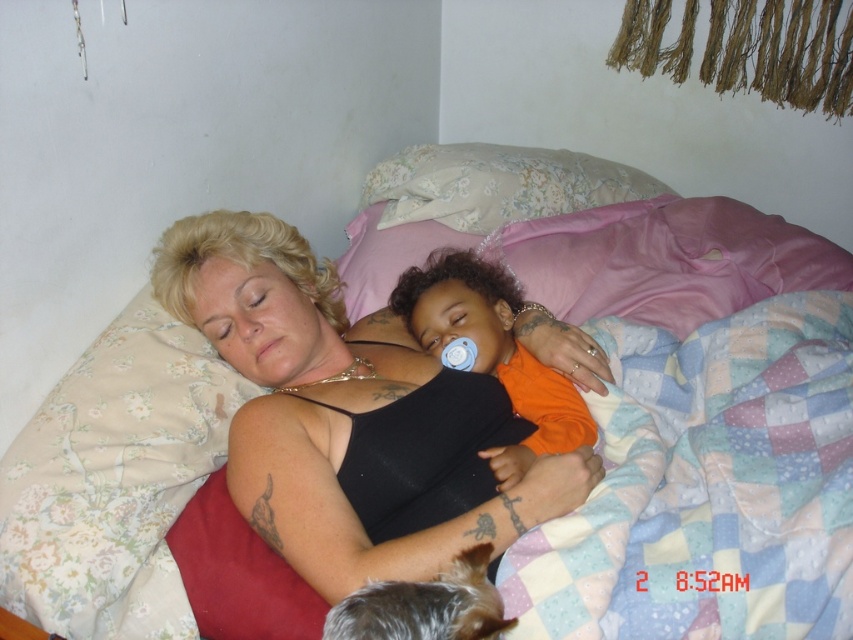
You are a photographer taking a photo of the scene. The camera is positioned to capture the entire bed. Where is the floral fabric pillow at upper center located in the image?

The floral fabric pillow at upper center is located at the 2D coordinates point (497, 184) in the image.

You are a parent who wants to place a small stuffed animal between the floral fabric pillow at upper center and the shiny brown fur at lower center. Can you fit it there?

The distance between the floral fabric pillow at upper center and the shiny brown fur at lower center is 3.52 feet, so yes, the stuffed animal can be placed there as there is enough space.